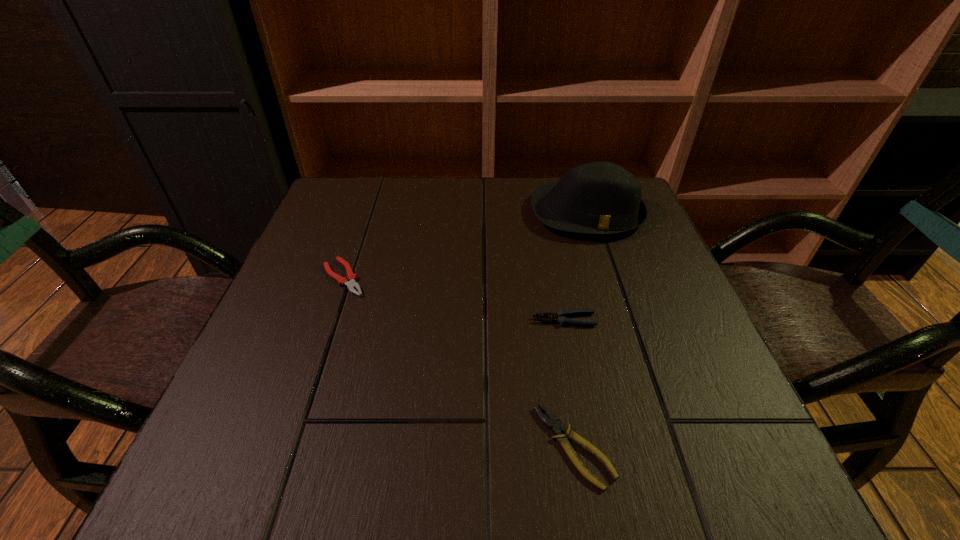
The image size is (960, 540). I want to click on vacant space that is in between the nearest pliers and the farthest pliers, so click(459, 362).

Identify the location of empty space between the fedora and the second farthest pliers. (575, 266).

You are a GUI agent. You are given a task and a screenshot of the screen. Output one action in this format:
    pyautogui.click(x=<x>, y=<y>)
    Task: Click on the free space between the third nearest object and the tallest pliers
    Image resolution: width=960 pixels, height=540 pixels.
    Given the screenshot: What is the action you would take?
    pyautogui.click(x=454, y=299)

Find the location of a particular element. The width and height of the screenshot is (960, 540). object that is the closest to the second tallest object is located at coordinates (554, 424).

Locate which object is the third closest to the second farthest object. Please provide its 2D coordinates. Your answer should be formatted as a tuple, i.e. [(x, y)], where the tuple contains the x and y coordinates of a point satisfying the conditions above.

[(554, 424)]

I want to click on pliers that is the closest one to the nearest pliers, so click(560, 316).

Identify which pliers is the second nearest to the farthest pliers. Please provide its 2D coordinates. Your answer should be formatted as a tuple, i.e. [(x, y)], where the tuple contains the x and y coordinates of a point satisfying the conditions above.

[(554, 424)]

Where is `vacant area in the image that satisfies the following two spatial constraints: 1. on the front-facing side of the fedora; 2. at the gripping part of the third shortest object`? The height and width of the screenshot is (540, 960). vacant area in the image that satisfies the following two spatial constraints: 1. on the front-facing side of the fedora; 2. at the gripping part of the third shortest object is located at coordinates (620, 320).